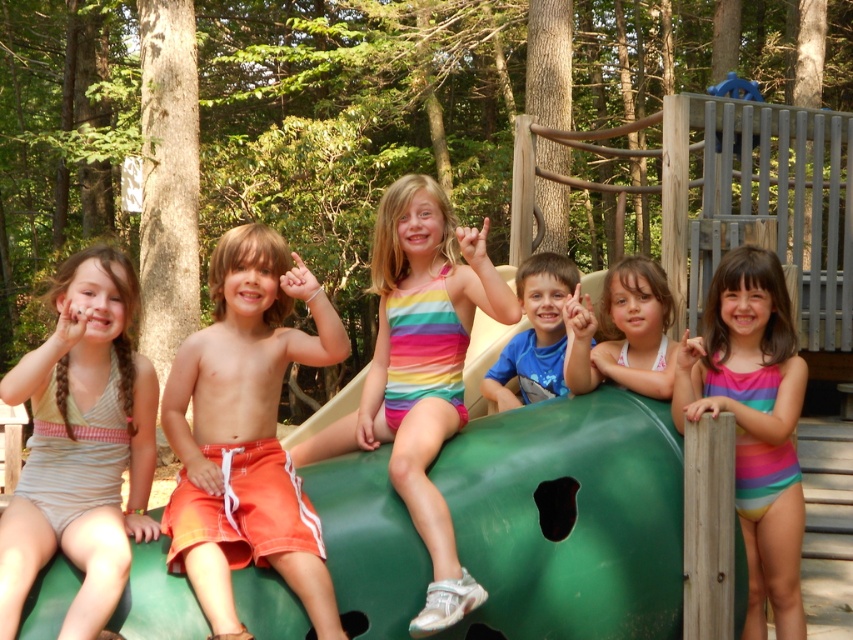
Which of these two, rainbow striped swimsuit at center or blue cotton shirt at center, stands taller?

rainbow striped swimsuit at center

Is rainbow striped swimsuit at center thinner than blue cotton shirt at center?

No.

Where is `rainbow striped swimsuit at center`? This screenshot has height=640, width=853. rainbow striped swimsuit at center is located at coordinates (421, 371).

Can you confirm if striped fabric swimsuit at left is positioned to the right of blue cotton shirt at center?

In fact, striped fabric swimsuit at left is to the left of blue cotton shirt at center.

Which is more to the right, striped fabric swimsuit at left or blue cotton shirt at center?

blue cotton shirt at center

Who is more distant from viewer, (108, 266) or (563, 291)?

Positioned behind is point (563, 291).

The height and width of the screenshot is (640, 853). Identify the location of striped fabric swimsuit at left. click(x=80, y=444).

Between point (195, 465) and point (56, 440), which one is positioned behind?

The point (195, 465) is behind.

Is orange fabric shorts at center closer to camera compared to striped fabric swimsuit at left?

No, it is behind striped fabric swimsuit at left.

Is point (303, 356) closer to viewer compared to point (154, 397)?

No.

Where is `orange fabric shorts at center`? orange fabric shorts at center is located at coordinates (247, 433).